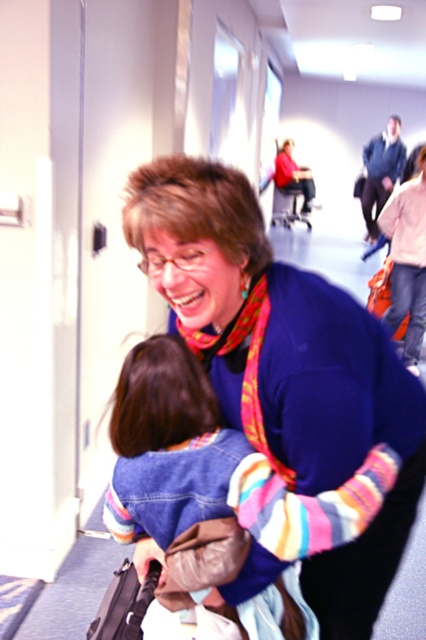
Question: Among these points, which one is farthest from the camera?

Choices:
 (A) (152, 168)
 (B) (411, 300)

Answer: (B)

Question: Is blue sweater at center above denim jacket at lower right?

Choices:
 (A) yes
 (B) no

Answer: (B)

Question: Is blue sweater at center thinner than denim jacket at lower right?

Choices:
 (A) no
 (B) yes

Answer: (A)

Question: In this image, where is blue sweater at center located relative to denim jacket at lower right?

Choices:
 (A) below
 (B) above

Answer: (A)